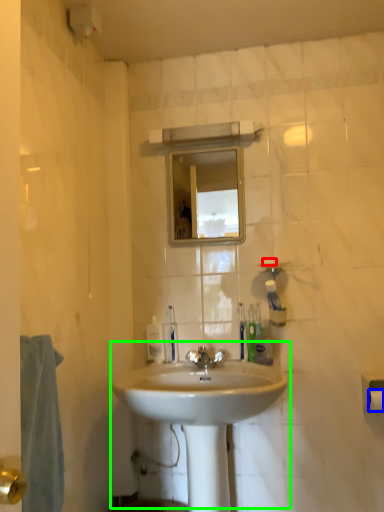
Question: Which object is positioned closest to soap (highlighted by a red box)? Select from toilet paper (highlighted by a blue box) and sink (highlighted by a green box).

Choices:
 (A) toilet paper
 (B) sink

Answer: (A)